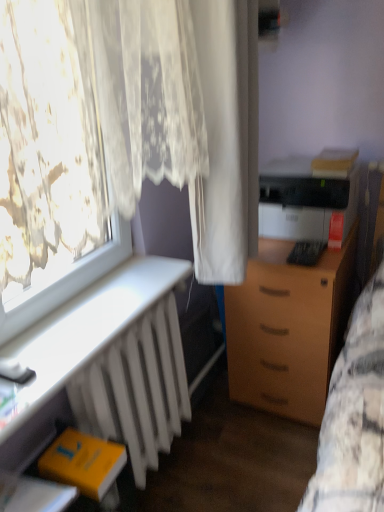
I want to click on free spot above white matte radiator at lower left (from a real-world perspective), so click(82, 317).